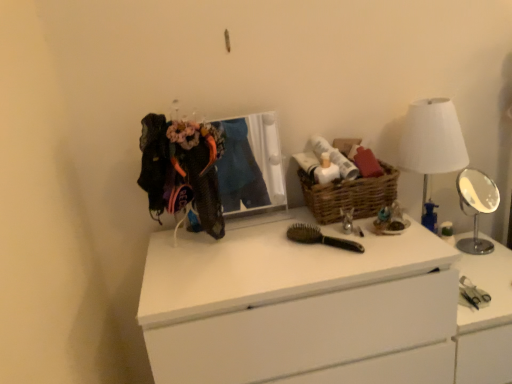
You are a GUI agent. You are given a task and a screenshot of the screen. Output one action in this format:
    pyautogui.click(x=<x>, y=<y>)
    Task: Click on the blank space above white fabric lampshade at right (from a real-world perspective)
    The image size is (512, 384).
    Given the screenshot: What is the action you would take?
    pyautogui.click(x=432, y=104)